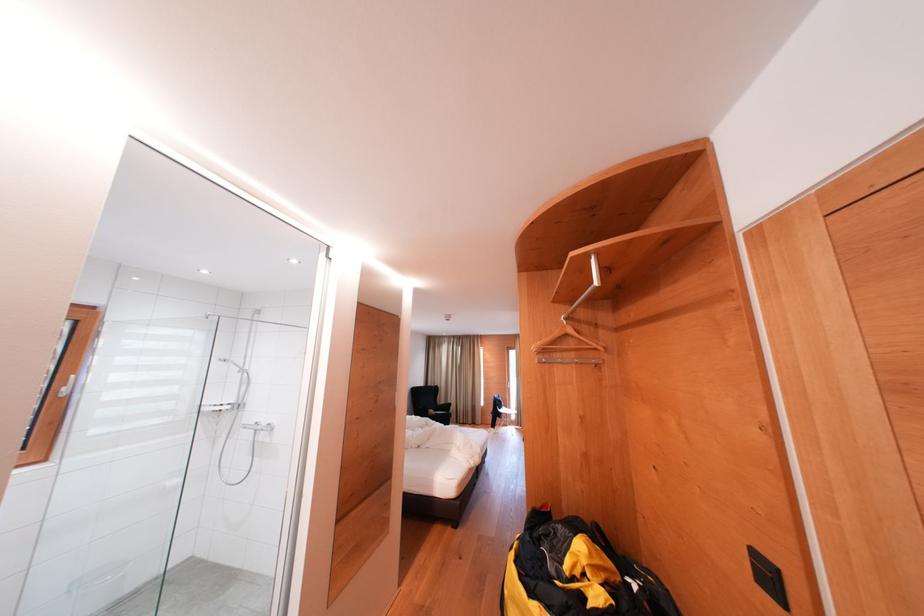
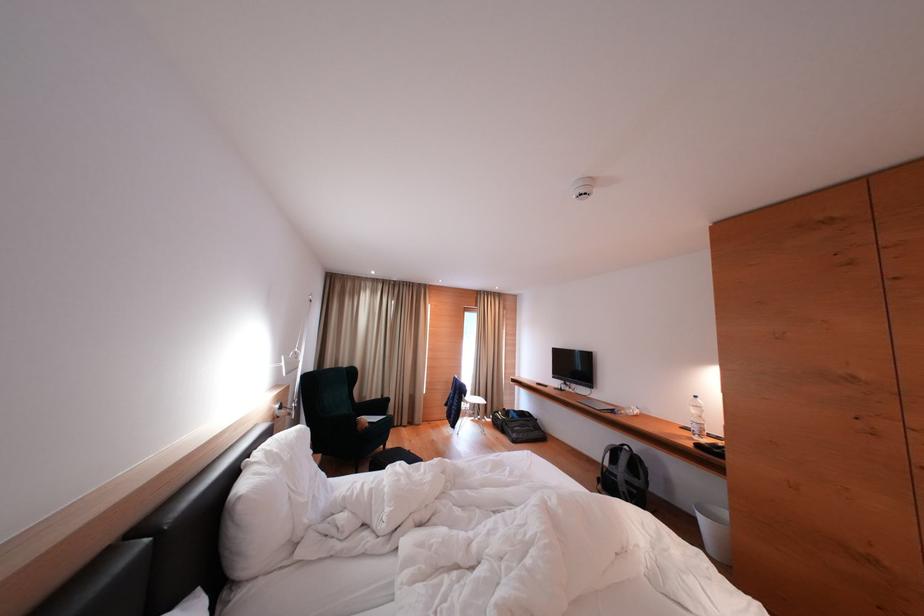
The point at (517,416) is marked in the first image. Where is the corresponding point in the second image?

(477, 402)